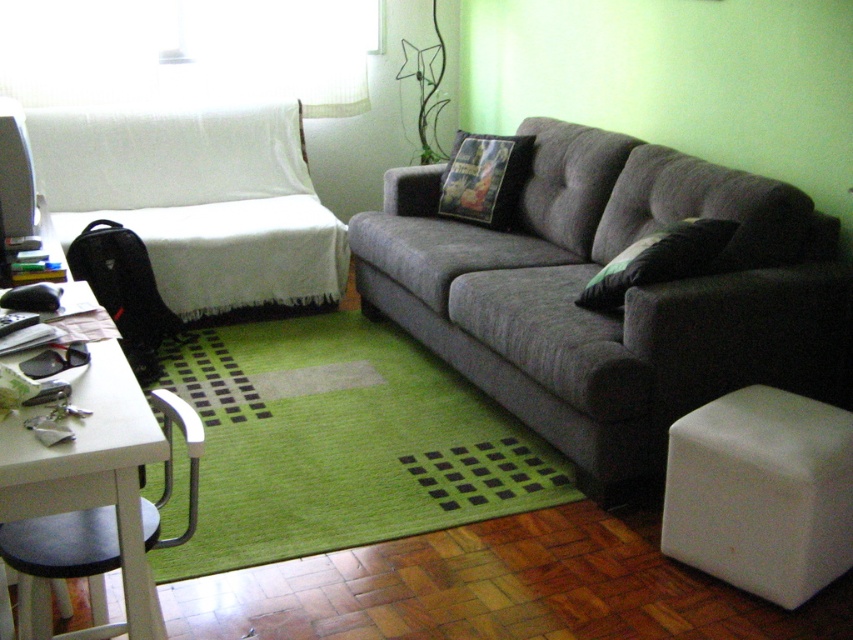
You are a delivery person trying to place a large package on the white fabric covered couch at left and the green textured pillow at right. Which object can the package be placed on without exceeding its height?

The white fabric covered couch at left has a greater height compared to the green textured pillow at right, so the package can be placed on the white fabric covered couch at left without exceeding its height.

You are standing in the living room and want to place a small table next to the white fabric covered couch at left. Based on its current position, where should you place the table?

The white fabric covered couch at left is located at point (196, 198), so you should place the table near those coordinates to position it next to the couch.